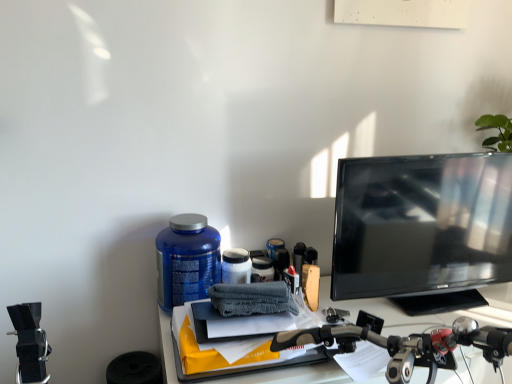
Where is `matte blue container at center`? The width and height of the screenshot is (512, 384). matte blue container at center is located at coordinates (186, 260).

The image size is (512, 384). Describe the element at coordinates (186, 260) in the screenshot. I see `matte blue container at center` at that location.

I want to click on black glossy monitor at right, so click(x=422, y=229).

Describe the element at coordinates (422, 229) in the screenshot. I see `black glossy monitor at right` at that location.

The width and height of the screenshot is (512, 384). In order to click on matte blue container at center in this screenshot , I will do `click(186, 260)`.

Which object is positioned more to the right, matte blue container at center or black glossy monitor at right?

From the viewer's perspective, black glossy monitor at right appears more on the right side.

Which object is further away from the camera, matte blue container at center or black glossy monitor at right?

matte blue container at center is behind.

Is point (169, 248) positioned in front of point (343, 262)?

That is True.

From the image's perspective, which one is positioned higher, matte blue container at center or black glossy monitor at right?

black glossy monitor at right.

From a real-world perspective, does matte blue container at center stand above black glossy monitor at right?

No.

Is matte blue container at center wider than black glossy monitor at right?

Indeed, matte blue container at center has a greater width compared to black glossy monitor at right.

Considering the sizes of objects matte blue container at center and black glossy monitor at right in the image provided, who is taller, matte blue container at center or black glossy monitor at right?

black glossy monitor at right.

Can you confirm if matte blue container at center is smaller than black glossy monitor at right?

Yes.

Can we say matte blue container at center lies outside black glossy monitor at right?

Yes, matte blue container at center is outside of black glossy monitor at right.

Is the surface of matte blue container at center in direct contact with black glossy monitor at right?

There is a gap between matte blue container at center and black glossy monitor at right.

Is matte blue container at center oriented away from black glossy monitor at right?

No, matte blue container at center is not facing away from black glossy monitor at right.

How many degrees apart are the facing directions of matte blue container at center and black glossy monitor at right?

5.88 degrees separate the facing orientations of matte blue container at center and black glossy monitor at right.

This screenshot has width=512, height=384. In order to click on bottle that appears on the left of black glossy monitor at right in this screenshot , I will do `click(186, 260)`.

Which is more to the left, black glossy monitor at right or matte blue container at center?

Positioned to the left is matte blue container at center.

Is the depth of black glossy monitor at right greater than that of matte blue container at center?

That is False.

Between point (389, 191) and point (217, 256), which one is positioned behind?

The point (217, 256) is farther.

From the image's perspective, is black glossy monitor at right under matte blue container at center?

Actually, black glossy monitor at right appears above matte blue container at center in the image.

From a real-world perspective, is black glossy monitor at right under matte blue container at center?

No.

Which object is thinner, black glossy monitor at right or matte blue container at center?

black glossy monitor at right is thinner.

From their relative heights in the image, would you say black glossy monitor at right is taller or shorter than matte blue container at center?

In the image, black glossy monitor at right appears to be taller than matte blue container at center.

Can you confirm if black glossy monitor at right is smaller than matte blue container at center?

No, black glossy monitor at right is not smaller than matte blue container at center.

Would you say black glossy monitor at right is outside matte blue container at center?

black glossy monitor at right is positioned outside matte blue container at center.

Can you see black glossy monitor at right touching matte blue container at center?

No, black glossy monitor at right is not touching matte blue container at center.

Is black glossy monitor at right oriented towards matte blue container at center?

No, black glossy monitor at right is not oriented towards matte blue container at center.

How different are the orientations of black glossy monitor at right and matte blue container at center in degrees?

They differ by 5.88 degrees in their facing directions.

This screenshot has height=384, width=512. Find the location of `bottle behind the black glossy monitor at right`. bottle behind the black glossy monitor at right is located at coordinates (186, 260).

Find the location of a particular element. This screenshot has height=384, width=512. television above the matte blue container at center (from a real-world perspective) is located at coordinates (422, 229).

Locate an element on the screen. television lying on the right of matte blue container at center is located at coordinates (422, 229).